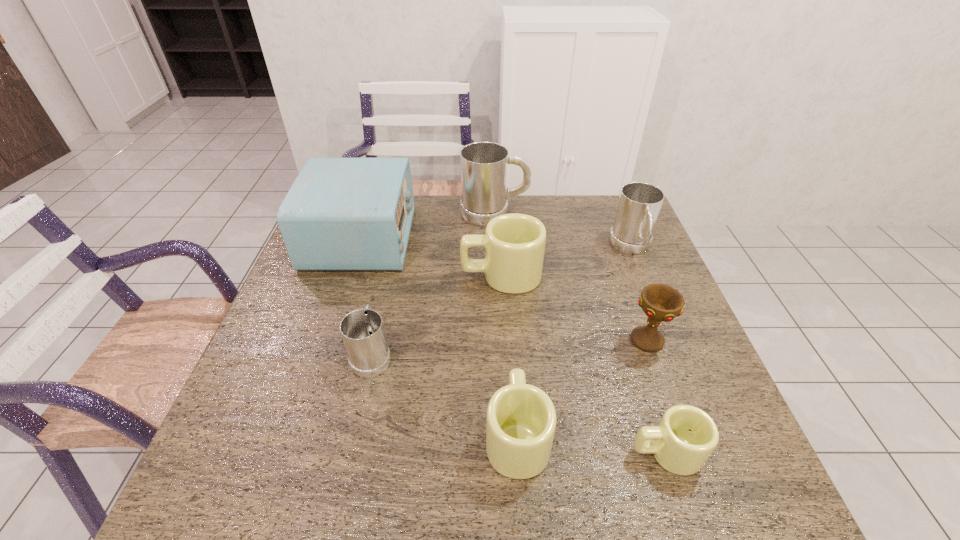
Locate an element on the screen. This screenshot has height=540, width=960. the rightmost beige mug is located at coordinates click(x=686, y=436).

Find the location of a particular element. the shortest object is located at coordinates pos(686,436).

Find the location of a particular element. This screenshot has width=960, height=540. blank space located 0.310m on the side of the biggest gray mug with the handle is located at coordinates (621, 213).

At what (x,y) coordinates should I click in order to perform the action: click on blank space located on the front panel of the radio receiver. Please return your answer as a coordinate pair (x, y). Looking at the image, I should click on (530, 238).

This screenshot has width=960, height=540. Identify the location of vacant region located on the side of the rightmost gray mug with the handle. (654, 301).

Where is `vacant point located with the handle on the side of the farthest beige mug`? This screenshot has width=960, height=540. vacant point located with the handle on the side of the farthest beige mug is located at coordinates (347, 275).

In order to click on vacant space located 0.390m with the handle on the side of the farthest beige mug in this screenshot , I will do `click(322, 275)`.

This screenshot has height=540, width=960. Identify the location of blank space located with the handle on the side of the farthest beige mug. (319, 275).

Where is `vacant space located 0.060m on the right of the red chalice`? This screenshot has height=540, width=960. vacant space located 0.060m on the right of the red chalice is located at coordinates (692, 341).

Identify the location of free space located 0.380m on the side of the nearest gray mug with the handle. pos(398,239).